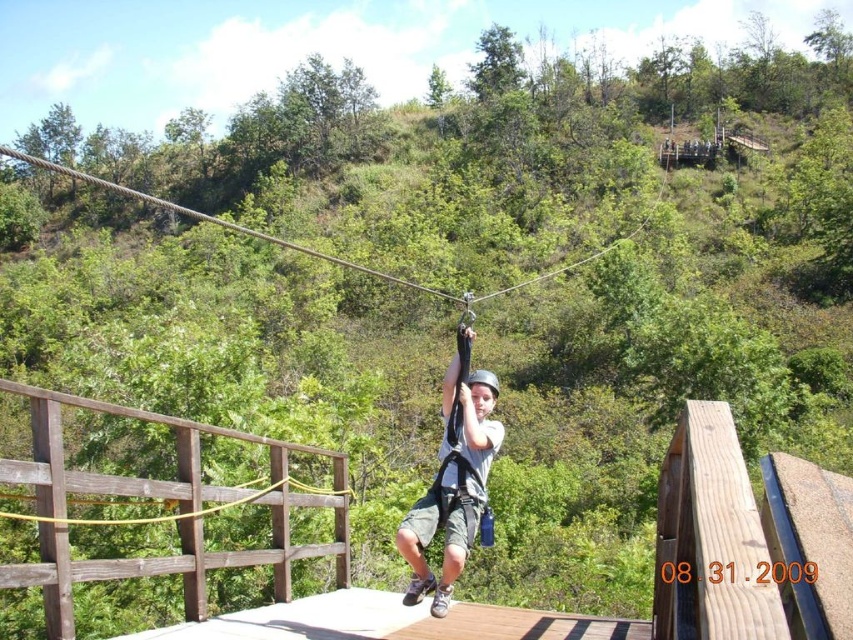
Question: Which point is closer to the camera?

Choices:
 (A) (251, 500)
 (B) (354, 268)
 (C) (467, 525)

Answer: (C)

Question: Is matte black harness at center below yellow rubber rope at center?

Choices:
 (A) yes
 (B) no

Answer: (B)

Question: Is brown rope at upper center below yellow rubber rope at center?

Choices:
 (A) yes
 (B) no

Answer: (B)

Question: Among these objects, which one is nearest to the camera?

Choices:
 (A) yellow rubber rope at center
 (B) matte black harness at center
 (C) brown rope at upper center

Answer: (A)

Question: Is matte black harness at center further to camera compared to yellow rubber rope at center?

Choices:
 (A) no
 (B) yes

Answer: (B)

Question: Which object is closer to the camera taking this photo?

Choices:
 (A) yellow rubber rope at center
 (B) brown rope at upper center

Answer: (A)